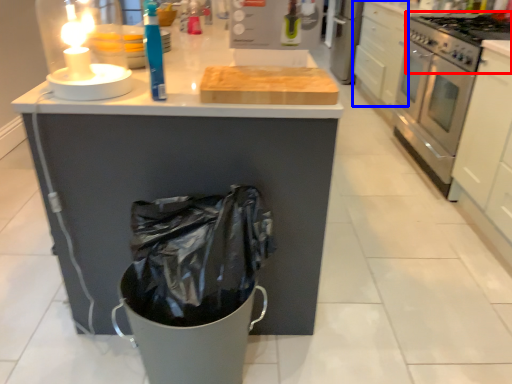
Question: Which object appears farthest to the camera in this image, gas stove (highlighted by a red box) or drawer (highlighted by a blue box)?

Choices:
 (A) gas stove
 (B) drawer

Answer: (B)